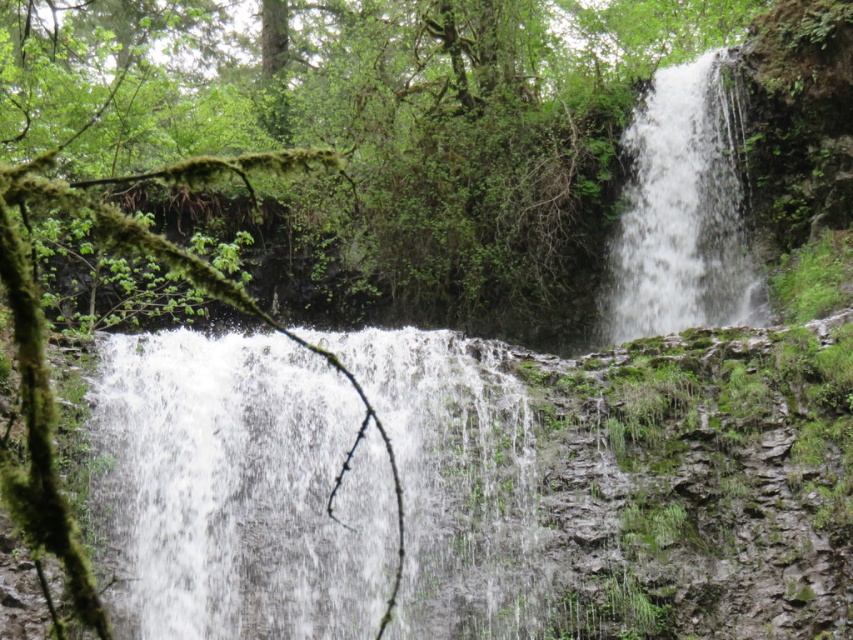
Is point (183, 600) less distant than point (633, 125)?

Yes, point (183, 600) is closer to viewer.

Image resolution: width=853 pixels, height=640 pixels. Describe the element at coordinates (239, 490) in the screenshot. I see `white frothy water at center` at that location.

You are a GUI agent. You are given a task and a screenshot of the screen. Output one action in this format:
    pyautogui.click(x=<x>, y=<y>)
    Task: Click on the white frothy water at center
    Image resolution: width=853 pixels, height=640 pixels.
    Given the screenshot: What is the action you would take?
    pyautogui.click(x=239, y=490)